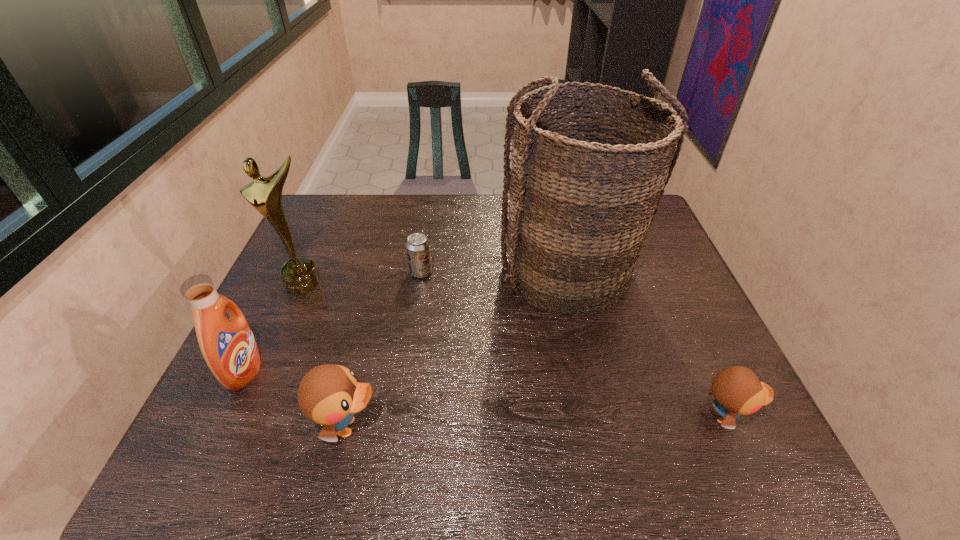
The width and height of the screenshot is (960, 540). Identify the location of the left duck. (329, 394).

Locate an element on the screen. the fourth tallest object is located at coordinates (329, 394).

Locate an element on the screen. Image resolution: width=960 pixels, height=540 pixels. the second shortest object is located at coordinates (737, 390).

Locate an element on the screen. This screenshot has width=960, height=540. the rightmost object is located at coordinates (737, 390).

Locate an element on the screen. beer can is located at coordinates (418, 251).

You are a GUI agent. You are given a task and a screenshot of the screen. Output one action in this format:
    pyautogui.click(x=<x>, y=<y>)
    Task: Click on the shortest object
    Image resolution: width=960 pixels, height=540 pixels.
    Given the screenshot: What is the action you would take?
    pyautogui.click(x=418, y=251)

Where is `the tallest object`? The height and width of the screenshot is (540, 960). the tallest object is located at coordinates (583, 192).

I want to click on basket, so click(x=583, y=192).

What are the coordinates of `the fifth shortest object` in the screenshot? It's located at (299, 275).

Find the location of `detergent`. detergent is located at coordinates (228, 346).